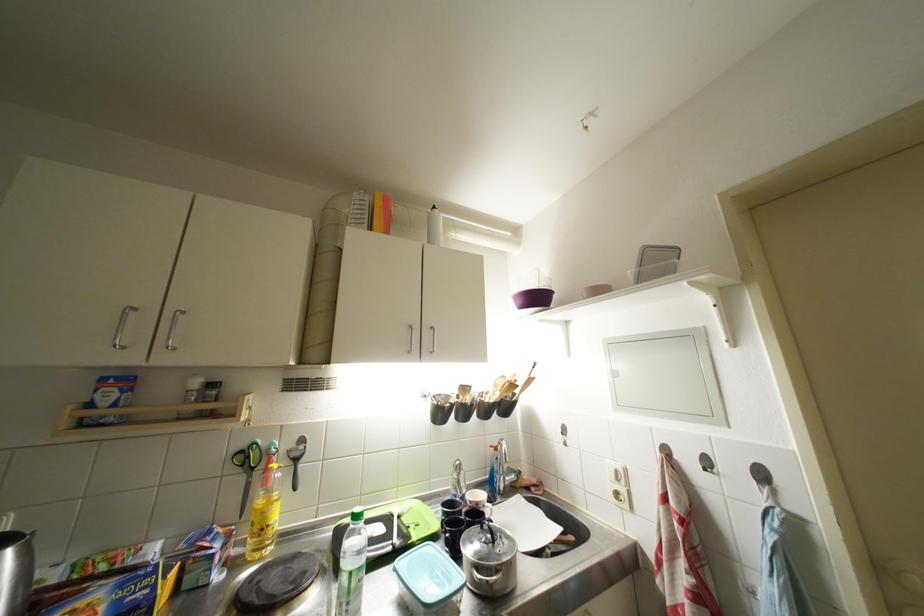
The image size is (924, 616). Describe the element at coordinates (457, 480) in the screenshot. I see `the faucet handle` at that location.